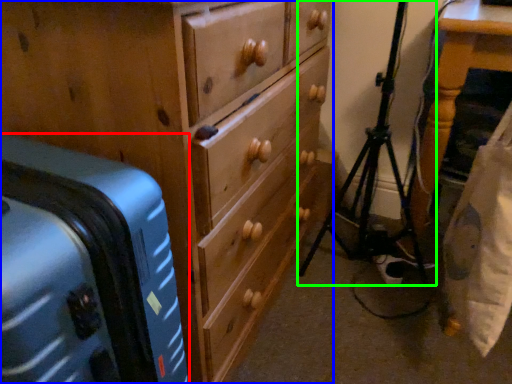
Question: Based on their relative distances, which object is nearer to suitcase (highlighted by a red box)? Choose from chest of drawers (highlighted by a blue box) and tripod (highlighted by a green box).

Choices:
 (A) chest of drawers
 (B) tripod

Answer: (A)